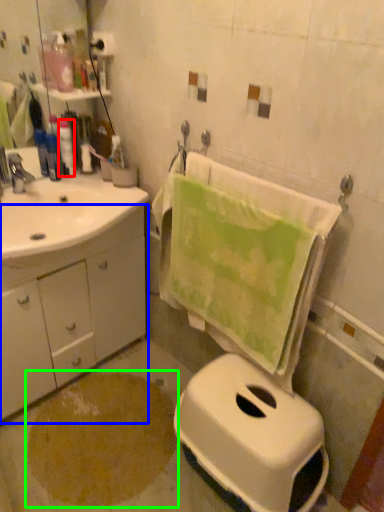
Question: Based on their relative distances, which object is nearer to toiletry (highlighted by a red box)? Choose from bathroom cabinet (highlighted by a blue box) and powder (highlighted by a green box).

Choices:
 (A) bathroom cabinet
 (B) powder

Answer: (A)